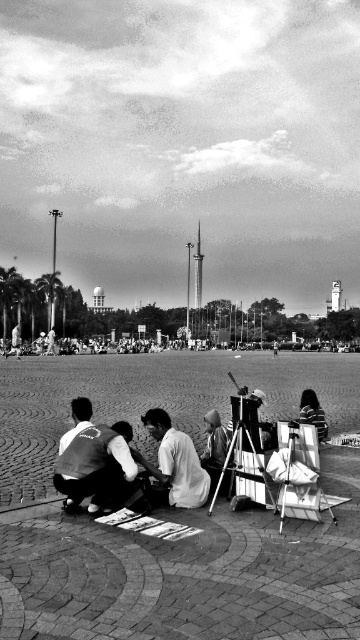
Consider the image. You are standing in the public square and want to take a photo of both the group of individuals in the foreground and the tower in the background. Which point, point (128, 476) or point (303, 404), is closer to your current position?

Point (128, 476) is closer to the camera than point (303, 404), so it is closer to your current position.

You are standing at the center of the public square and see the white cotton shirt at center located at point (92, 461). If you walk straight ahead, will you eventually reach the tower or monument in the background?

The white cotton shirt at center is located at point (92, 461), which is in the center of the public square. Since the tower or monument is in the background, walking straight ahead from the center would lead towards the tower or monument in the background.

You are an artist who wants to set up your easel in the public square. You see the metallic tripod at center and the white cotton shirt at center. Which object should you avoid placing your easel near to ensure it doesn

You should avoid placing your easel near the metallic tripod at center because it is bigger than the white cotton shirt at center, which means it might take up more space and obstruct your view or movement.